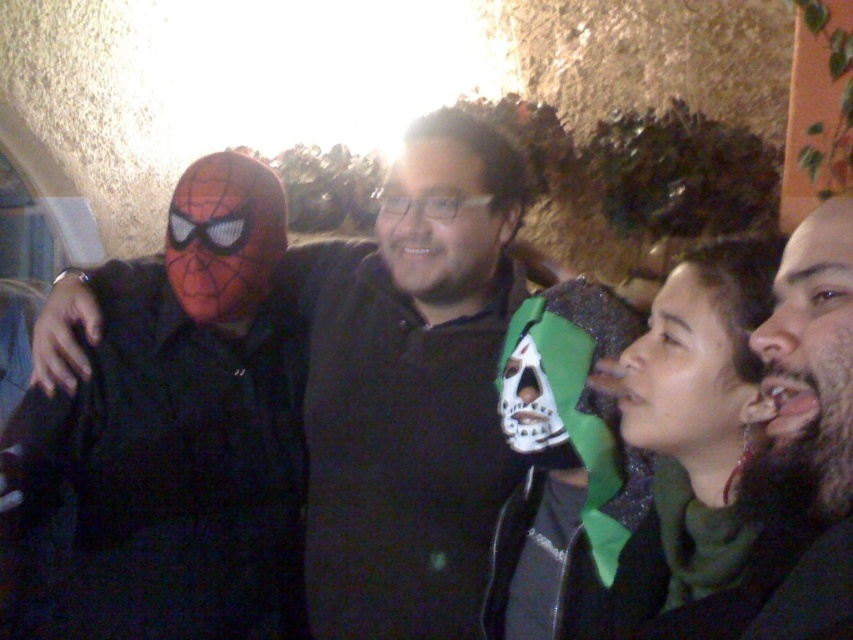
Between matte black mask at left and bearded dark hair at right, which one has more height?

matte black mask at left is taller.

Who is more forward, (x=434, y=342) or (x=828, y=573)?

Positioned in front is point (x=828, y=573).

Is point (437, 406) positioned before point (827, 403)?

No, (437, 406) is behind (827, 403).

I want to click on matte black mask at left, so click(x=410, y=388).

Does matte black mask at left have a larger size compared to green glittery scarf at lower right?

Correct, matte black mask at left is larger in size than green glittery scarf at lower right.

Is matte black mask at left to the right of green glittery scarf at lower right from the viewer's perspective?

No, matte black mask at left is not to the right of green glittery scarf at lower right.

Who is more distant from viewer, (x=434, y=196) or (x=712, y=314)?

The point (x=434, y=196) is more distant.

At what (x,y) coordinates should I click in order to perform the action: click on matte black mask at left. Please return your answer as a coordinate pair (x, y). This screenshot has width=853, height=640. Looking at the image, I should click on (410, 388).

Does green glittery scarf at lower right have a larger size compared to bearded dark hair at right?

Yes.

Between point (721, 625) and point (795, 570), which one is positioned in front?

Point (795, 570) is in front.

Where is `green glittery scarf at lower right`? The height and width of the screenshot is (640, 853). green glittery scarf at lower right is located at coordinates (701, 449).